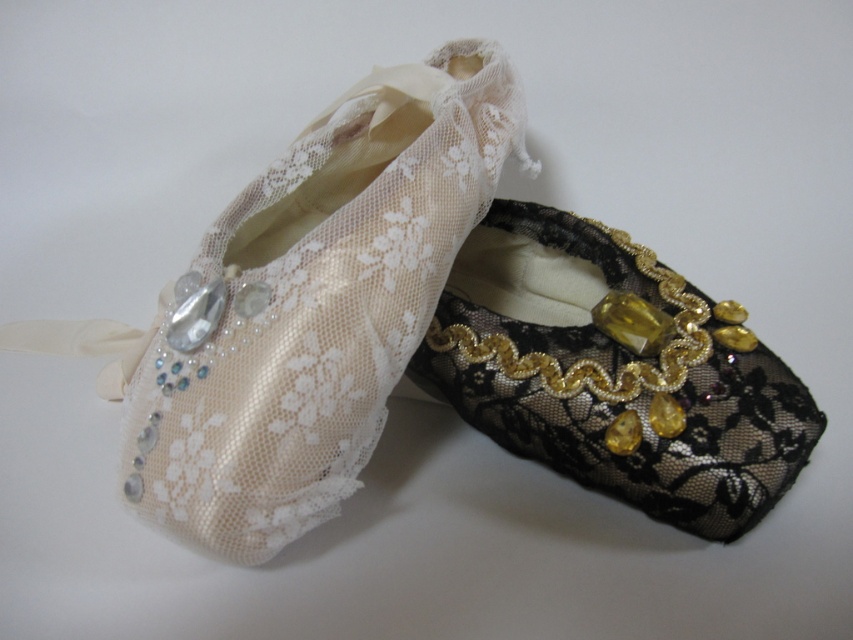
You are a dancer preparing for a performance and need to choose between the ivory lace slipper at left and the black lace slipper at right. The stage has a spotlight that will shine directly on the slippers. Which slipper will cast a larger shadow on the stage floor?

The ivory lace slipper at left is positioned over the black lace slipper at right, so it will cast a larger shadow on the stage floor because it is higher up and closer to the light source.

You are a dancer preparing for a performance and need to choose between the ivory lace slipper at left and the black lace slipper at right. Which slipper is located to the left of the other?

The ivory lace slipper at left is positioned on the left side of black lace slipper at right.

In the scene shown: You are a dancer trying to choose between the ivory lace slipper at left and the black lace slipper at right for a performance. Which slipper has a wider base to provide better stability?

The ivory lace slipper at left might be wider than black lace slipper at right, so it could provide better stability for the performance.